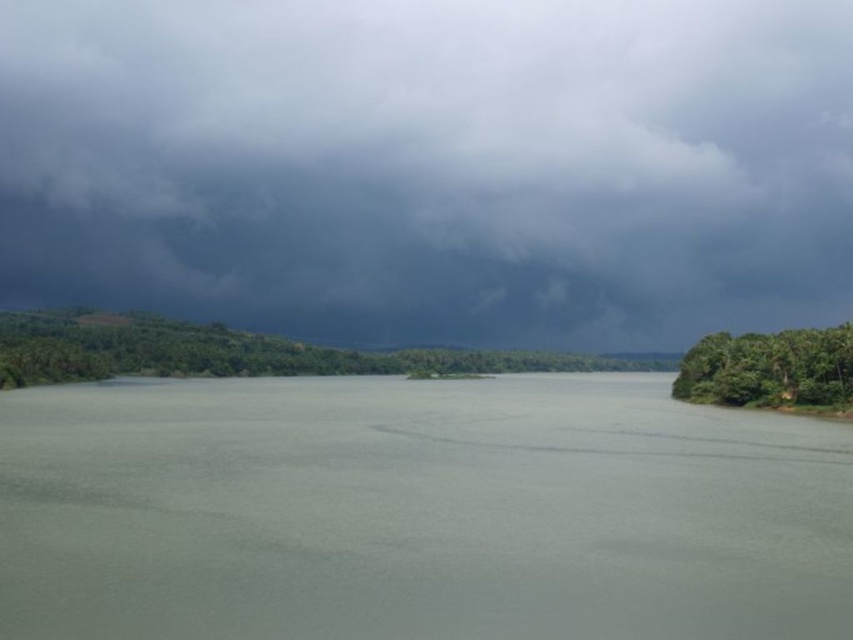
Question: Does dark gray cloud at upper center have a smaller size compared to green leafy trees at right?

Choices:
 (A) no
 (B) yes

Answer: (A)

Question: Can you confirm if dark gray cloud at upper center is positioned to the right of gray matte water at center?

Choices:
 (A) no
 (B) yes

Answer: (A)

Question: Considering the real-world distances, which object is closest to the dark gray cloud at upper center?

Choices:
 (A) green leafy trees at center
 (B) gray matte water at center
 (C) green leafy trees at right

Answer: (A)

Question: Which object is the closest to the green leafy trees at center?

Choices:
 (A) gray matte water at center
 (B) green leafy trees at right

Answer: (A)

Question: Which point is closer to the camera taking this photo?

Choices:
 (A) (808, 378)
 (B) (425, 592)
 (C) (596, 204)

Answer: (B)

Question: Is gray matte water at center closer to camera compared to green leafy trees at right?

Choices:
 (A) yes
 (B) no

Answer: (A)